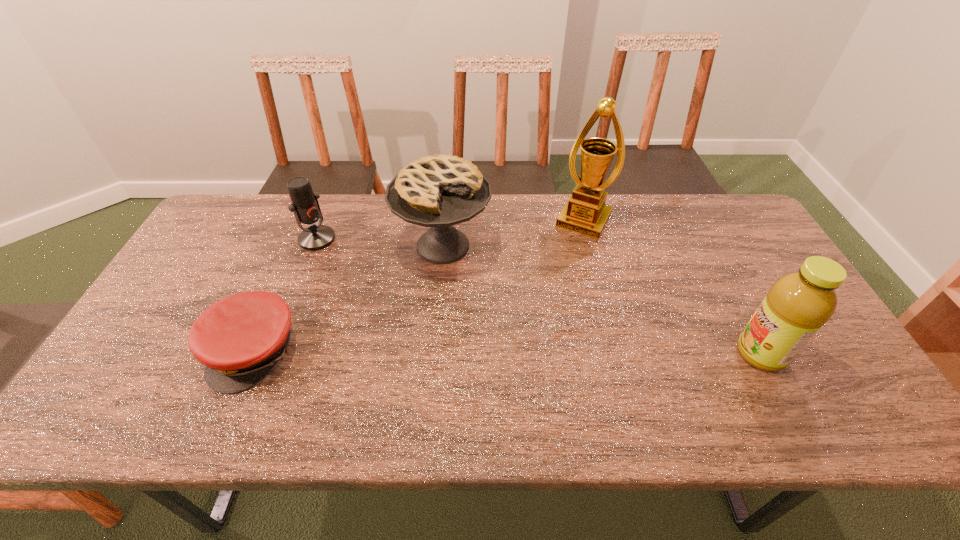
This screenshot has height=540, width=960. Identify the location of free space at the near right corner of the desktop. (829, 390).

You are a GUI agent. You are given a task and a screenshot of the screen. Output one action in this format:
    pyautogui.click(x=<x>, y=<y>)
    Task: Click on the free space between the third object from right to left and the cap
    The image size is (960, 540).
    Given the screenshot: What is the action you would take?
    pyautogui.click(x=348, y=299)

Locate an element on the screen. This screenshot has width=960, height=540. free point between the cap and the rightmost object is located at coordinates (508, 353).

This screenshot has height=540, width=960. I want to click on empty space that is in between the award and the third object from left to right, so click(x=514, y=233).

Find the location of `unoccupied area between the fruit juice and the second object from right to left`. unoccupied area between the fruit juice and the second object from right to left is located at coordinates (672, 287).

Where is `empty space between the second object from right to left and the third object from right to left`? The width and height of the screenshot is (960, 540). empty space between the second object from right to left and the third object from right to left is located at coordinates (514, 233).

Image resolution: width=960 pixels, height=540 pixels. In order to click on free space between the rightmost object and the microphone in this screenshot , I will do `click(539, 296)`.

You are a GUI agent. You are given a task and a screenshot of the screen. Output one action in this format:
    pyautogui.click(x=<x>, y=<y>)
    Task: Click on the free space between the rightmost object and the tallest object
    The width and height of the screenshot is (960, 540).
    Given the screenshot: What is the action you would take?
    pyautogui.click(x=672, y=287)

The image size is (960, 540). Find the location of `empty location between the pie and the tallest object`. empty location between the pie and the tallest object is located at coordinates (514, 233).

Locate an element on the screen. blank region between the cap and the fourth object from left to right is located at coordinates (420, 286).